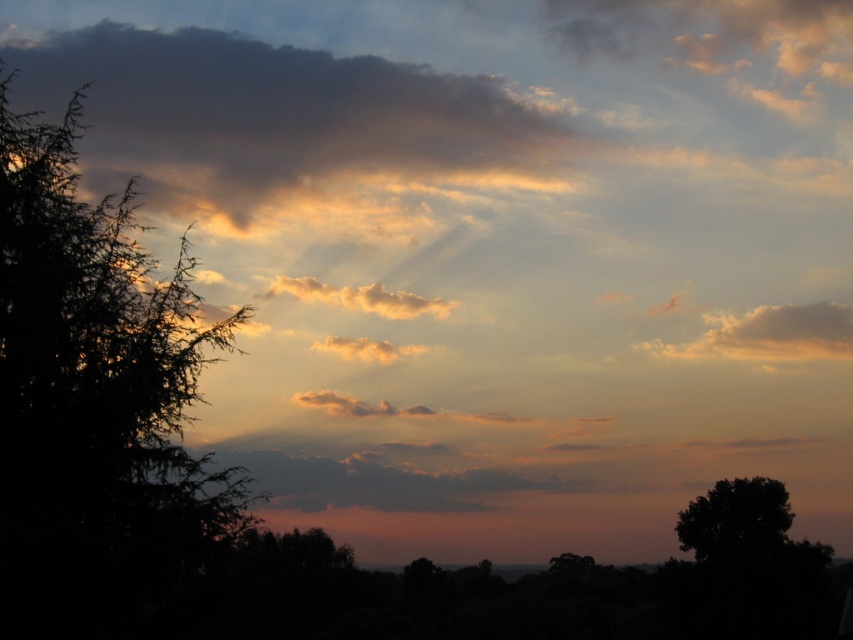
Question: Which point is closer to the camera?

Choices:
 (A) green matte tree at lower right
 (B) dark gray cloud at upper left
 (C) sandy yellow cloud at upper right

Answer: (A)

Question: Which of the following is the farthest from the observer?

Choices:
 (A) green matte tree at lower right
 (B) dark green leafy tree at left
 (C) sandy yellow cloud at upper right

Answer: (C)

Question: Where is golden fluffy cloud at center located in relation to green matte tree at lower right in the image?

Choices:
 (A) right
 (B) left

Answer: (B)

Question: From the image, what is the correct spatial relationship of dark green leafy tree at left in relation to sandy yellow cloud at upper right?

Choices:
 (A) left
 (B) right

Answer: (A)

Question: Which object is positioned farthest from the black matte tree at lower right?

Choices:
 (A) sandy yellow cloud at upper right
 (B) dark gray cloud at upper left
 (C) golden fluffy cloud at center
 (D) dark green leafy tree at left

Answer: (D)

Question: Does black matte tree at lower right come in front of green matte tree at lower right?

Choices:
 (A) no
 (B) yes

Answer: (B)